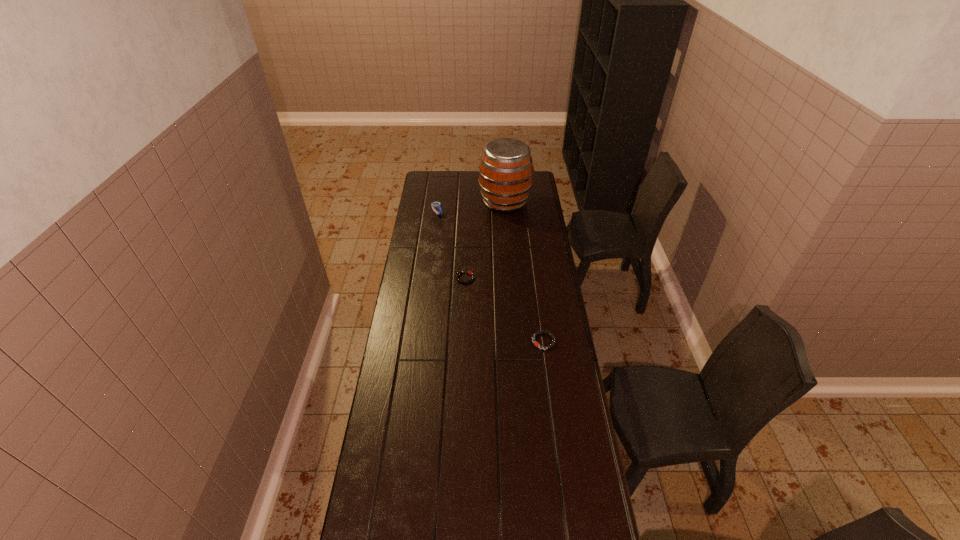
Image resolution: width=960 pixels, height=540 pixels. What are the coordinates of `vacant area that satisfies the following two spatial constraints: 1. on the front side of the cider; 2. on the left side of the right bracelet` in the screenshot? It's located at (515, 341).

At what (x,y) coordinates should I click in order to perform the action: click on free space that satisfies the following two spatial constraints: 1. on the front side of the left bracelet; 2. on the right side of the nearest object. Please return your answer as a coordinate pair (x, y). Looking at the image, I should click on (463, 341).

What are the coordinates of `free space that satisfies the following two spatial constraints: 1. on the front side of the nearest object; 2. on the left side of the second nearest object` in the screenshot? It's located at (463, 341).

This screenshot has height=540, width=960. What are the coordinates of `vacant point that satisfies the following two spatial constraints: 1. on the front side of the second tallest object; 2. on the right side of the right bracelet` in the screenshot? It's located at [421, 341].

The height and width of the screenshot is (540, 960). What are the coordinates of `free space that satisfies the following two spatial constraints: 1. on the back side of the third farthest object; 2. on the left side of the cider` in the screenshot? It's located at (468, 201).